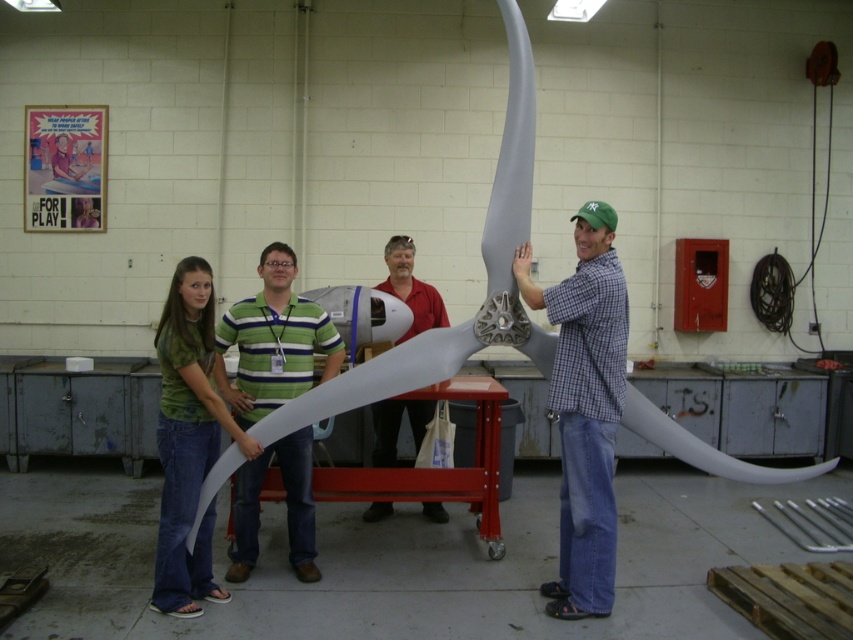
You are standing in the workshop and need to locate the person wearing the green striped shirt at center. According to the coordinates provided, where should you look?

The green striped shirt at center is located at point 0.534 on the x axis and 0.321 on the y axis.